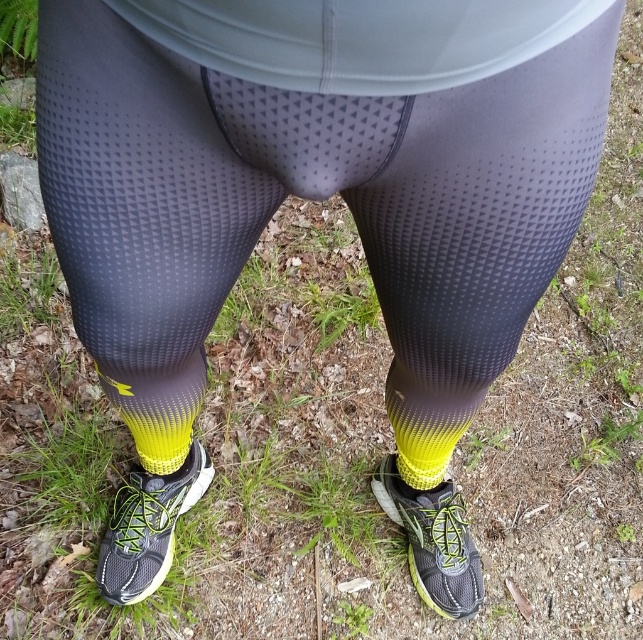
Question: Is yellow mesh shoe at lower center to the left of yellow gradient fabric sock at lower center from the viewer's perspective?

Choices:
 (A) no
 (B) yes

Answer: (B)

Question: From the image, what is the correct spatial relationship of matte black shoe at lower center in relation to yellow mesh sock at lower center?

Choices:
 (A) below
 (B) above

Answer: (A)

Question: Among these points, which one is farthest from the camera?

Choices:
 (A) (449, 596)
 (B) (165, 408)
 (C) (422, 401)
 (D) (113, 579)

Answer: (A)

Question: Which is farther from the yellow mesh sock at lower center?

Choices:
 (A) yellow gradient fabric sock at lower center
 (B) yellow mesh shoe at lower center
 (C) matte black shoe at lower center

Answer: (C)

Question: Is yellow mesh shoe at lower center wider than matte black shoe at lower center?

Choices:
 (A) no
 (B) yes

Answer: (A)

Question: Which point is closer to the camera?

Choices:
 (A) matte black shoe at lower center
 (B) yellow mesh shoe at lower center
 (C) yellow mesh sock at lower center
 (D) yellow gradient fabric sock at lower center

Answer: (C)